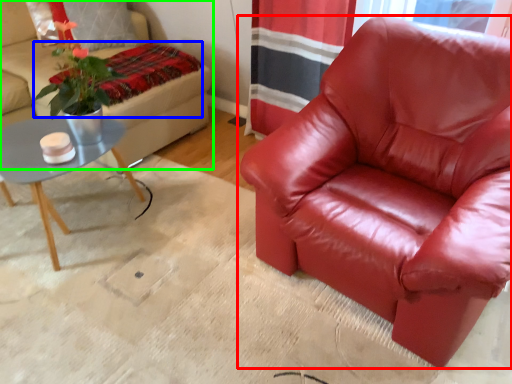
Question: Considering the real-world distances, which object is farthest from chair (highlighted by a red box)? blanket (highlighted by a blue box) or studio couch (highlighted by a green box)?

Choices:
 (A) blanket
 (B) studio couch

Answer: (B)